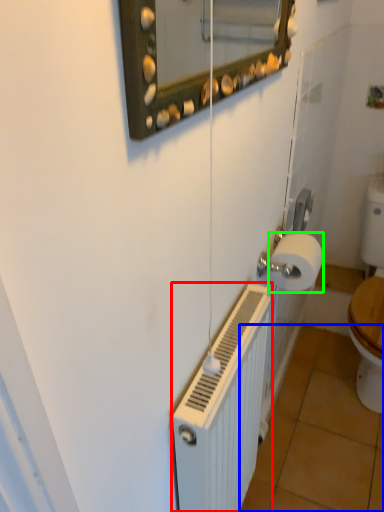
Question: Estimate the real-world distances between objects in this image. Which object is closer to radiator (highlighted by a red box), tile (highlighted by a blue box) or toilet paper (highlighted by a green box)?

Choices:
 (A) tile
 (B) toilet paper

Answer: (B)